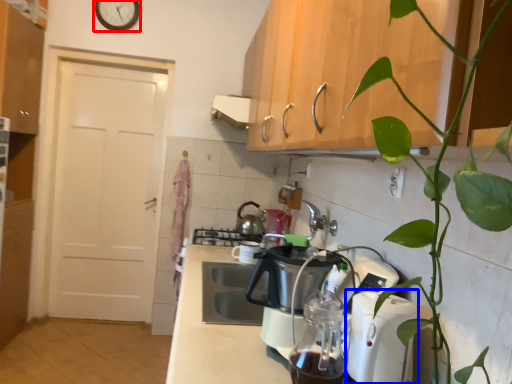
Question: Which object is further to the camera taking this photo, clock (highlighted by a red box) or kitchen appliance (highlighted by a blue box)?

Choices:
 (A) clock
 (B) kitchen appliance

Answer: (A)